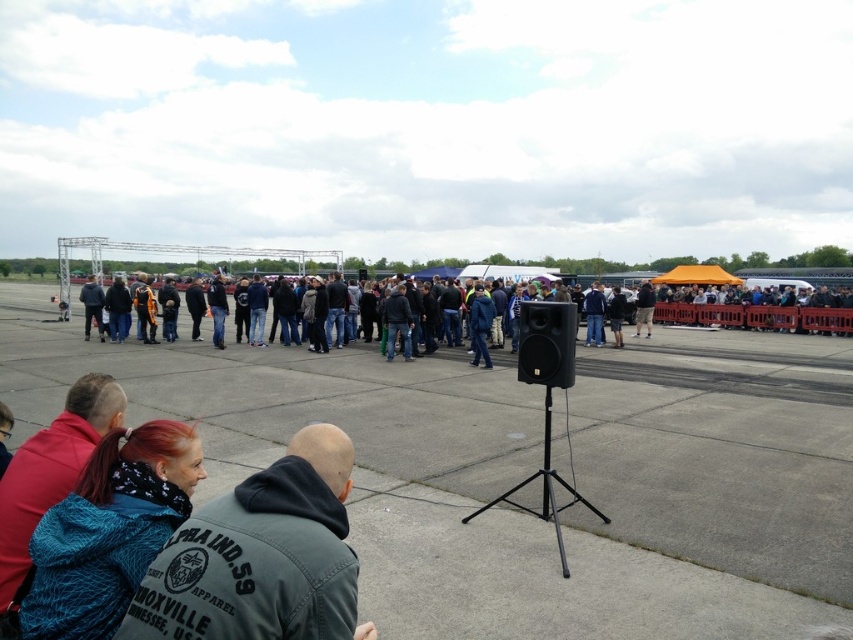
You are a photographer trying to capture a clear shot of the gray concrete tarmac at center and the dark gray casual clothing at center. Based on their positions, which object should you focus on first to ensure both are in the frame?

The gray concrete tarmac at center is in front of the dark gray casual clothing at center, so you should focus on the gray concrete tarmac at center first to ensure both are in the frame.

What is the coordinate of the gray concrete tarmac at center?

The gray concrete tarmac at center is located at coordinate point [508,481].

You are planning to set up a small booth for the event and need to choose between placing it on the gray concrete tarmac at center or the red knit sweater at lower left. Based on the scene description, which location has more space for your booth?

The gray concrete tarmac at center is larger in size than the red knit sweater at lower left, so the gray concrete tarmac at center would provide more space for your booth.